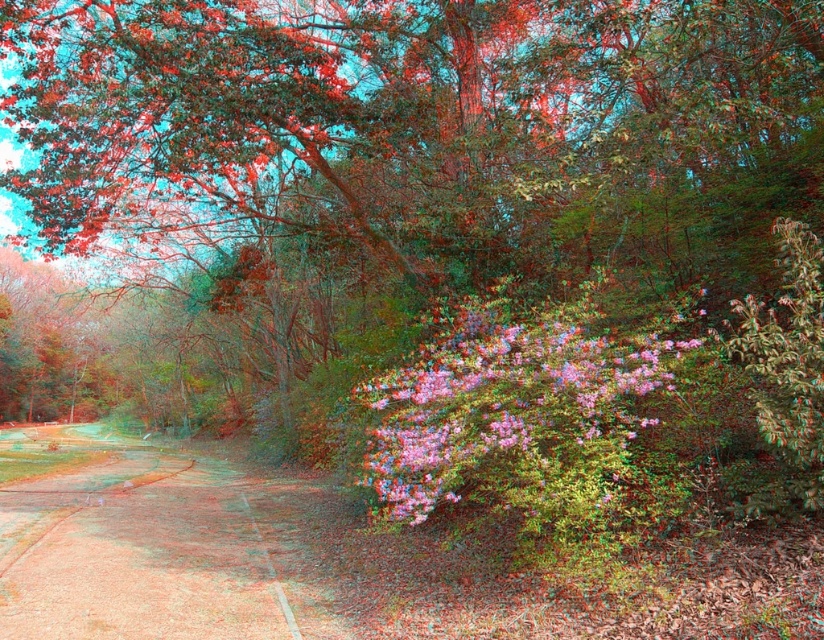
Which is below, brown dirt path at lower left or pink textured bush at center?

brown dirt path at lower left

Does brown dirt path at lower left appear over pink textured bush at center?

No, brown dirt path at lower left is not above pink textured bush at center.

The height and width of the screenshot is (640, 824). What are the coordinates of `brown dirt path at lower left` in the screenshot? It's located at (162, 544).